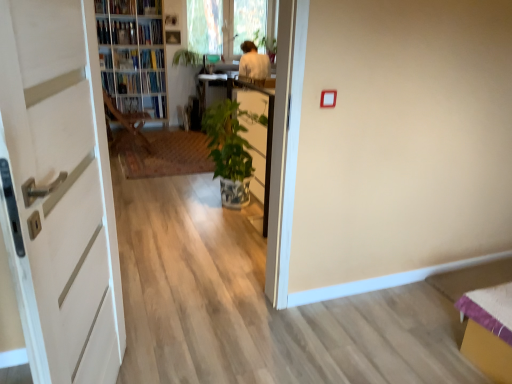
Question: Considering their positions, is green glossy plant at upper center located in front of or behind hardcover book at center, which ranks as the 1th book in right-to-left order?

Choices:
 (A) front
 (B) behind

Answer: (B)

Question: Is green glossy plant at upper center wider or thinner than hardcover book at center, which ranks as the 1th book in right-to-left order?

Choices:
 (A) wide
 (B) thin

Answer: (B)

Question: Considering the real-world distances, which object is closest to the green glossy plant at upper center?

Choices:
 (A) green glossy plant at center
 (B) wooden chair at center
 (C) wooden bookshelf at upper left
 (D) hardcover book at upper left, the 3th book from the left
 (E) hardcover book at upper left, which ranks as the third book in right-to-left order

Answer: (C)

Question: Considering the real-world distances, which object is farthest from the matte white book at upper left, the first book when ordered from left to right?

Choices:
 (A) green glazed pot at center
 (B) wooden bookshelf at upper left
 (C) hardcover book at upper left, which ranks as the third book in right-to-left order
 (D) white matte door at left
 (E) green glossy plant at upper center

Answer: (D)